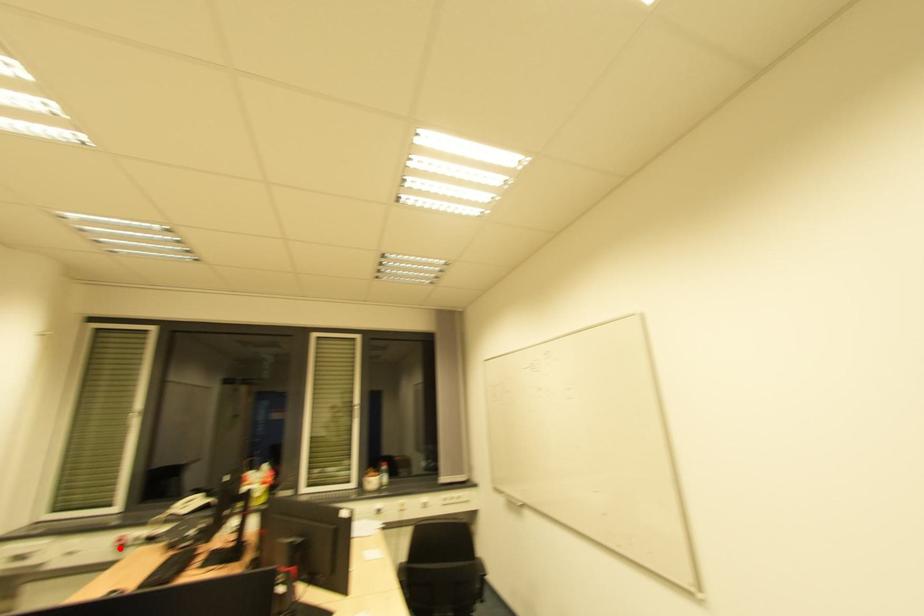
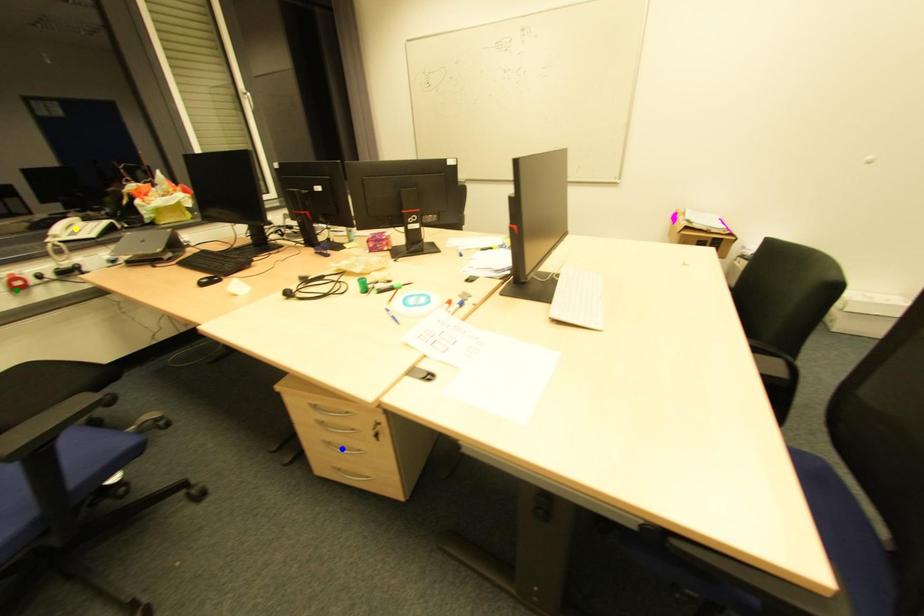
Question: I am providing you with two images of the same scene from different viewpoints. A red point is marked on the first image. You are given multiple points on the second image. Can you choose the point in image 2 that corresponds to the point in image 1?

Choices:
 (A) green point
 (B) blue point
 (C) yellow point

Answer: (A)